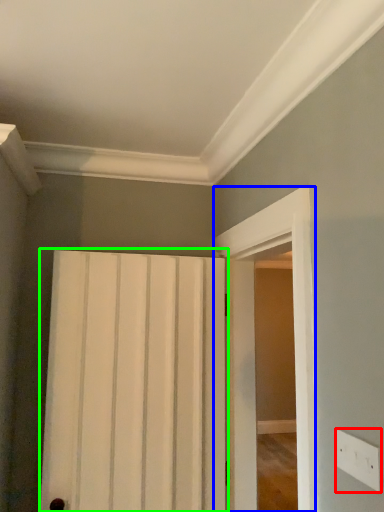
Question: Which object is the farthest from electric outlet (highlighted by a red box)? Choose among these: screen door (highlighted by a blue box) or door (highlighted by a green box).

Choices:
 (A) screen door
 (B) door

Answer: (B)